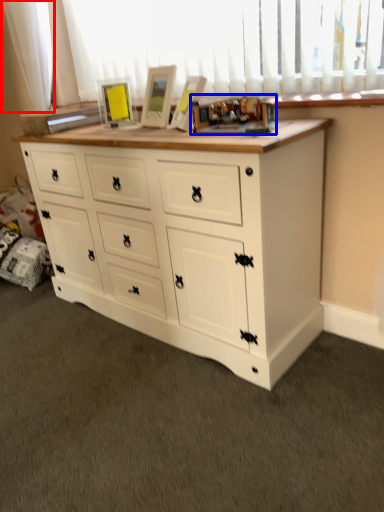
Question: Which of the following is the farthest to the observer, curtain (highlighted by a red box) or toy (highlighted by a blue box)?

Choices:
 (A) curtain
 (B) toy

Answer: (A)